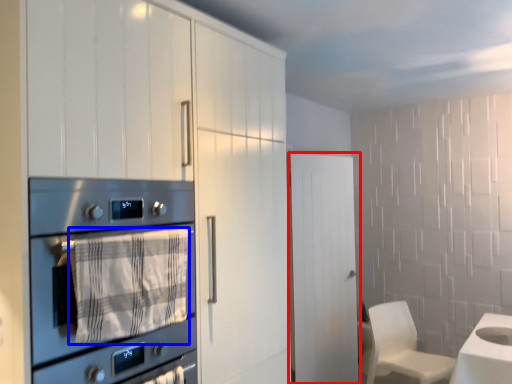
Question: Which point is closer to the camera, door (highlighted by a red box) or blanket (highlighted by a blue box)?

Choices:
 (A) door
 (B) blanket

Answer: (B)